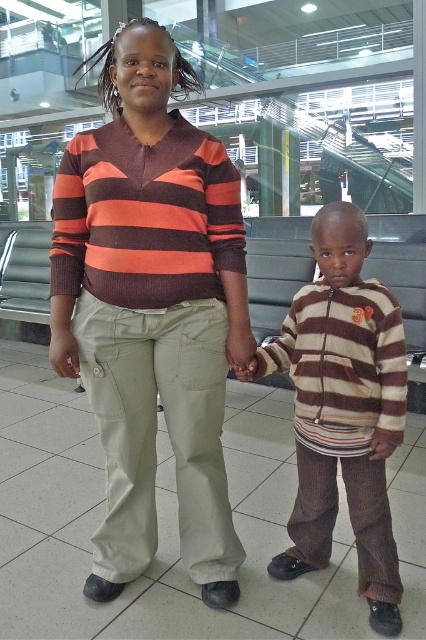
Question: Which object is positioned closest to the matte striped sweater at center?

Choices:
 (A) brown corduroy pants at lower right
 (B) khaki cotton pants at center

Answer: (B)

Question: Is the position of brown corduroy pants at lower right less distant than that of khaki cotton pants at center?

Choices:
 (A) yes
 (B) no

Answer: (A)

Question: Which of the following is the farthest from the observer?

Choices:
 (A) (213, 436)
 (B) (135, 376)

Answer: (A)

Question: Is matte striped sweater at center smaller than khaki cotton pants at center?

Choices:
 (A) no
 (B) yes

Answer: (A)

Question: Which object is positioned closest to the khaki cotton pants at center?

Choices:
 (A) matte striped sweater at center
 (B) brown corduroy pants at lower right

Answer: (A)

Question: Does matte striped sweater at center appear on the right side of khaki cotton pants at center?

Choices:
 (A) yes
 (B) no

Answer: (B)